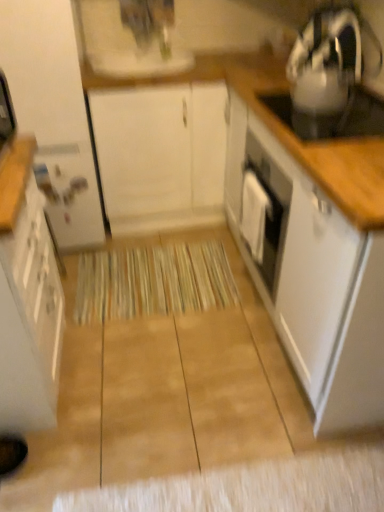
Locate an element on the screen. The width and height of the screenshot is (384, 512). free spot to the right of metallic silver kettle at upper right is located at coordinates (364, 104).